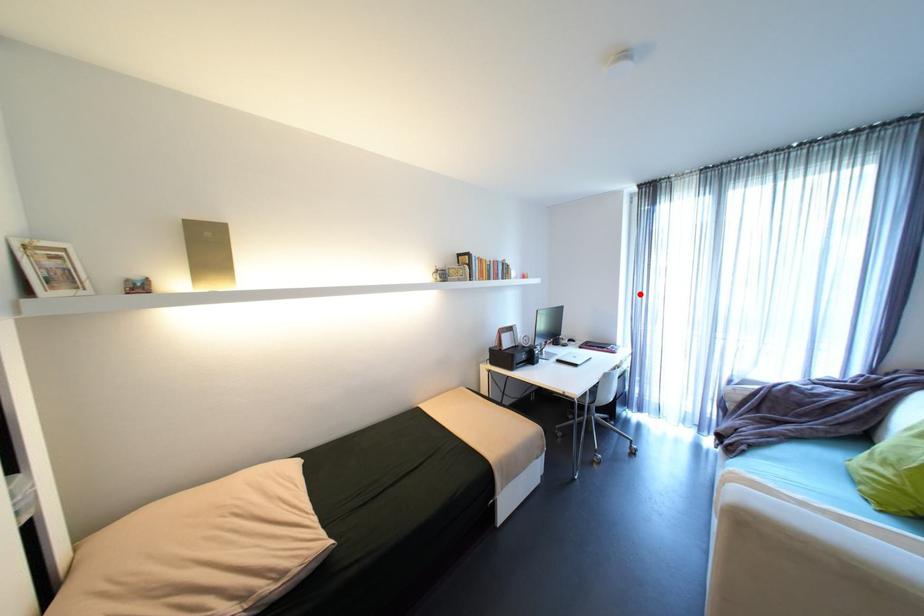
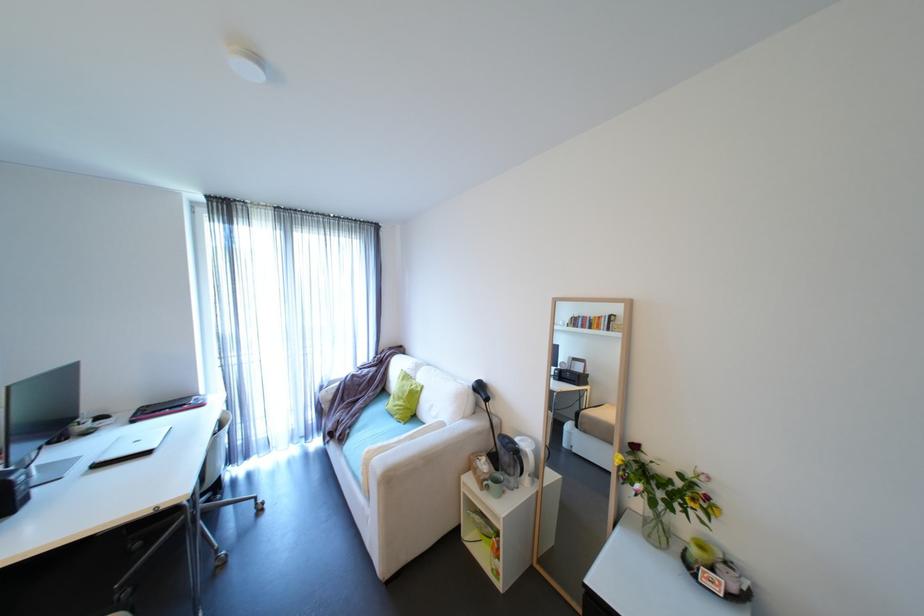
Locate, in the second image, the point that corresponds to the highlighted location in the first image.

(225, 326)